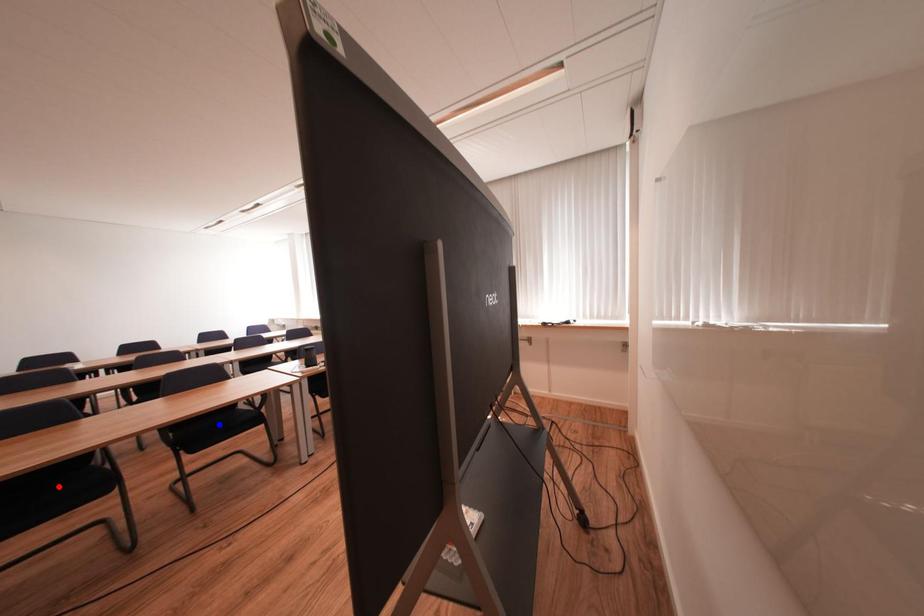
Question: Which of the two points in the image is closer to the camera?

Choices:
 (A) Blue point is closer.
 (B) Red point is closer.

Answer: (B)